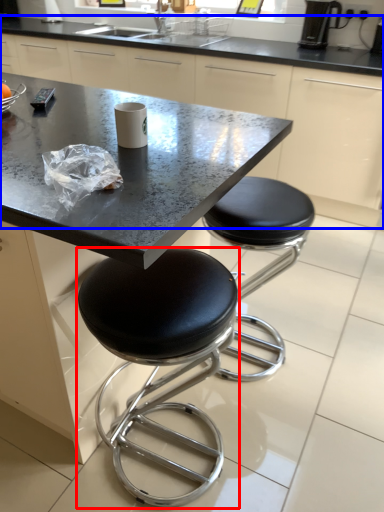
Question: Which of the following is the closest to the observer, stool (highlighted by a red box) or counter (highlighted by a blue box)?

Choices:
 (A) stool
 (B) counter

Answer: (A)